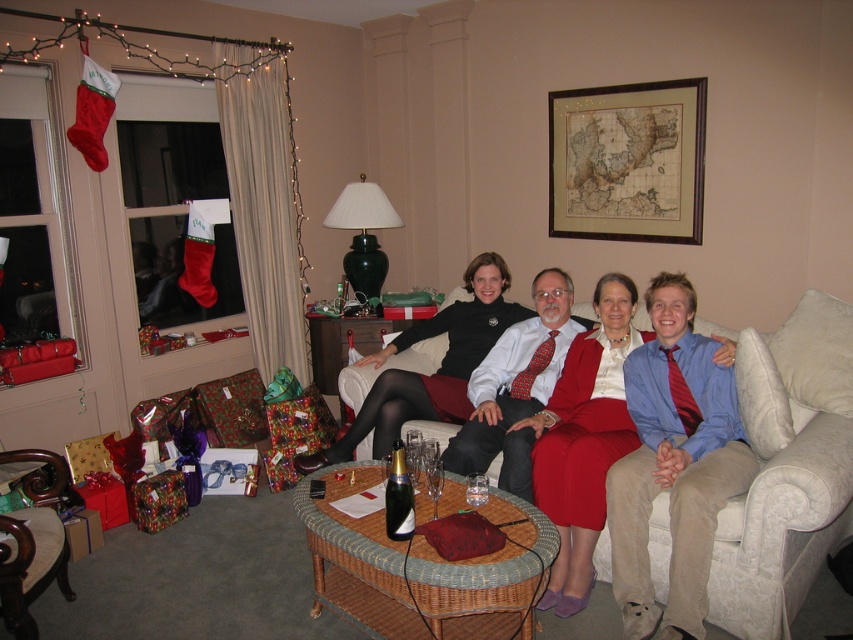
You are standing at the point labeled point (474, 365) and want to walk to the point labeled point (392, 458). Which direction should you move to get closer to your destination?

Since point (474, 365) is behind point (392, 458), you should move forward to get closer to your destination.

You are a photographer taking a picture of the matte black dress at center and the dark wood armchair at lower left. Which object is closer to the camera?

The matte black dress at center is closer to the camera than the dark wood armchair at lower left.